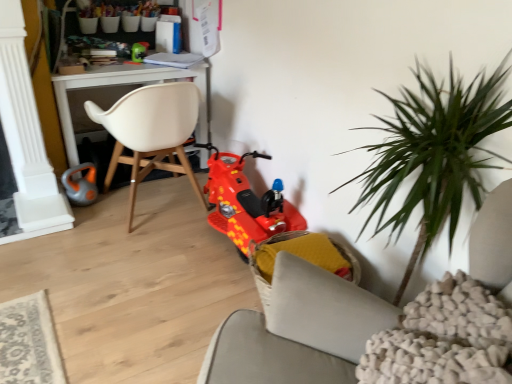
In order to click on vacant space that is in between orange rubber toy at lower left, placed as the 2th toy when sorted from top to bottom, and yellow fabric chair at lower center, the 1th chair from the right in this screenshot , I will do `click(168, 248)`.